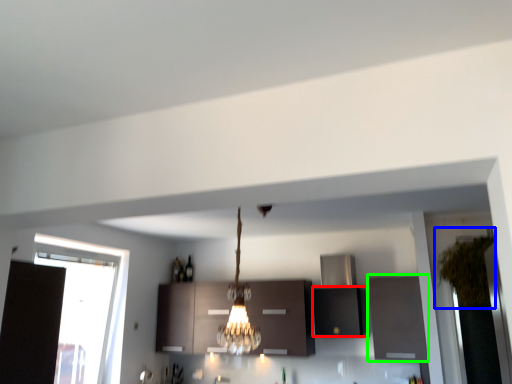
Question: Estimate the real-world distances between objects in this image. Which object is closer to cabinetry (highlighted by a red box), plant (highlighted by a blue box) or cabinetry (highlighted by a green box)?

Choices:
 (A) plant
 (B) cabinetry

Answer: (B)